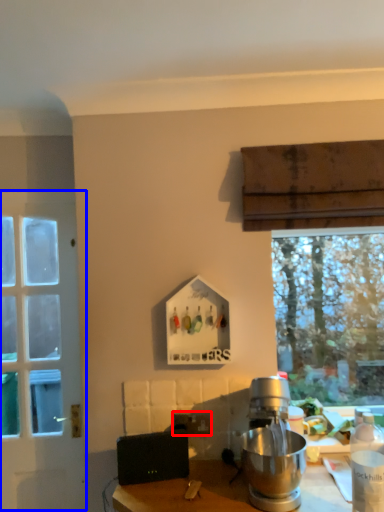
Question: Which of the following is the farthest to the observer, power outlet (highlighted by a red box) or door (highlighted by a blue box)?

Choices:
 (A) power outlet
 (B) door

Answer: (B)